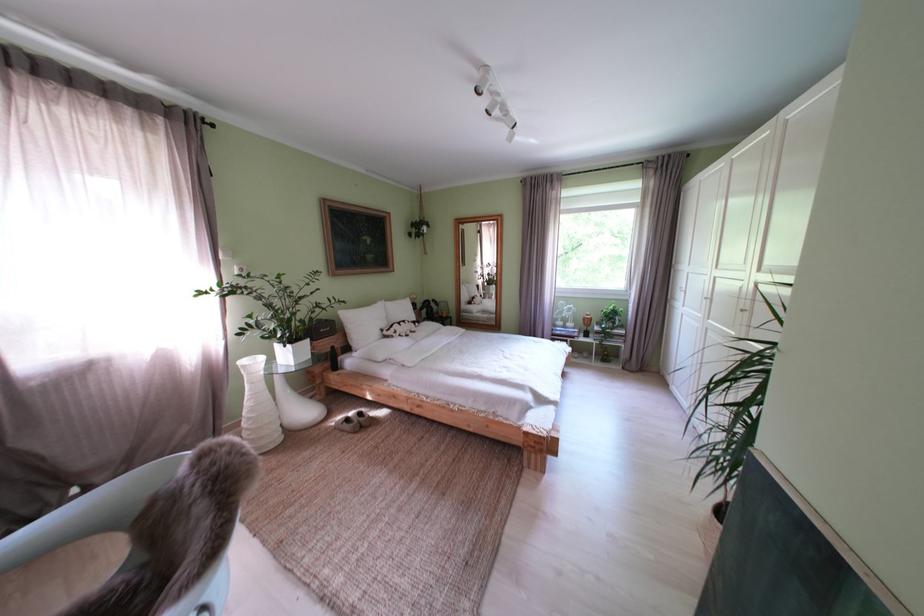
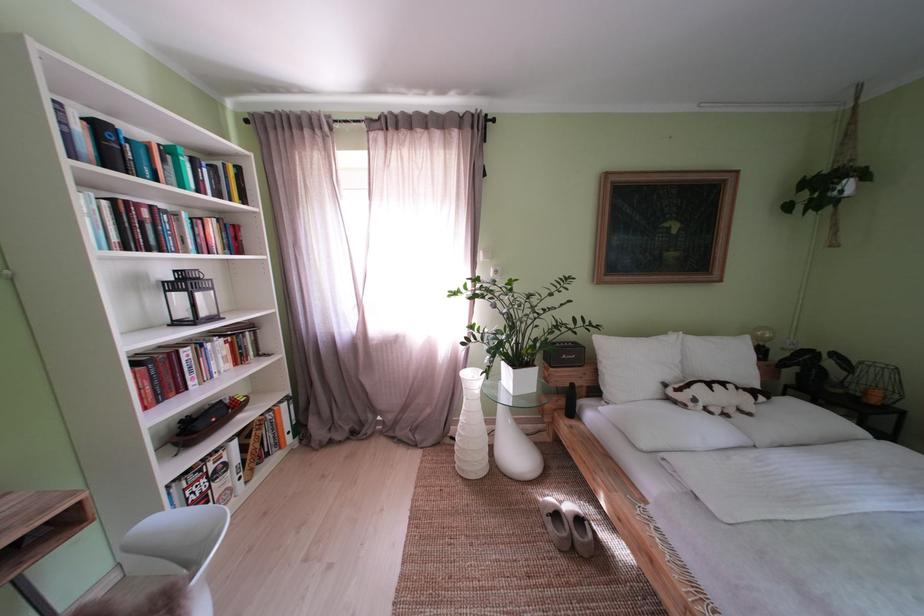
Question: The camera is either moving clockwise (left) or counter-clockwise (right) around the object. The first image is from the beginning of the video and the second image is from the end. Is the camera moving left or right when shooting the video?

Choices:
 (A) Left
 (B) Right

Answer: (B)